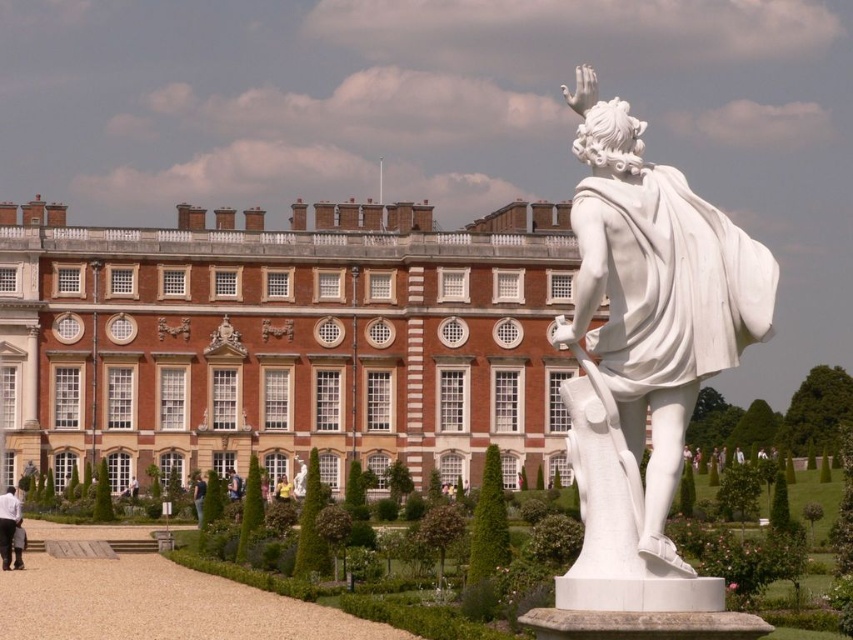
You are an event planner setting up for a garden party. You have two decorative fabric pieces, the white fabric shirt at lower left and the yellow fabric dress at center. Which fabric piece is wider?

The white fabric shirt at lower left is wider than the yellow fabric dress at center.

You are a photographer setting up a shoot in front of the grand historical building. You have two props to place in the foreground near the statue pedestal. The props are the white fabric shirt at lower left and the blue denim jeans at lower center. Which prop should you choose if you want the one that takes up more visual space in the photo?

The white fabric shirt at lower left is larger in size than the blue denim jeans at lower center, so you should choose the white fabric shirt at lower left to take up more visual space in the photo.